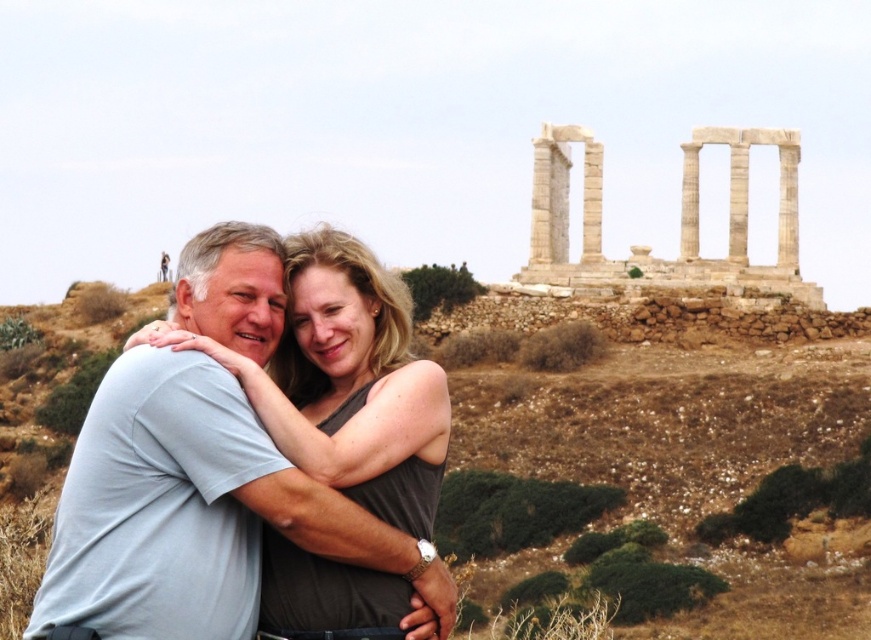
Question: Does brown grassy hillside at lower center have a larger size compared to matte gray tank top at center?

Choices:
 (A) yes
 (B) no

Answer: (A)

Question: Estimate the real-world distances between objects in this image. Which object is farther from the white marble columns at upper center?

Choices:
 (A) brown grassy hillside at lower center
 (B) matte gray tank top at center

Answer: (B)

Question: Among these objects, which one is nearest to the camera?

Choices:
 (A) brown grassy hillside at lower center
 (B) white marble columns at upper center

Answer: (A)

Question: In this image, where is brown grassy hillside at lower center located relative to matte gray tank top at center?

Choices:
 (A) above
 (B) below

Answer: (B)

Question: Which point appears closest to the camera in this image?

Choices:
 (A) (335, 282)
 (B) (750, 141)
 (C) (514, 404)

Answer: (A)

Question: Does matte gray tank top at center appear on the left side of white marble columns at upper center?

Choices:
 (A) yes
 (B) no

Answer: (A)